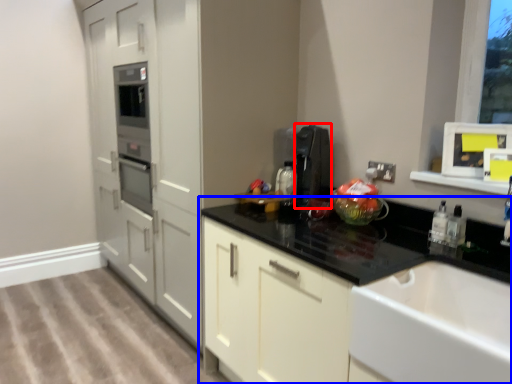
Question: Which object is further to the camera taking this photo, appliance (highlighted by a red box) or countertop (highlighted by a blue box)?

Choices:
 (A) appliance
 (B) countertop

Answer: (A)